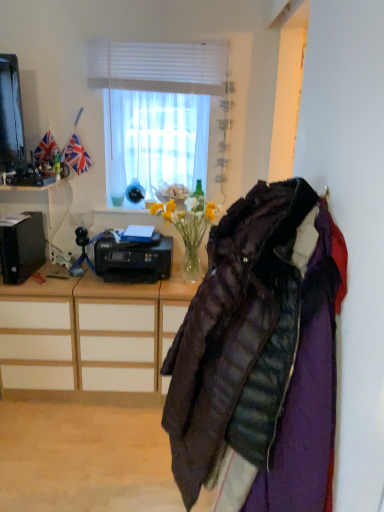
Question: From the image's perspective, is black plastic printer at left, the 2th desk ordered from the bottom, on white matte window at upper center?

Choices:
 (A) yes
 (B) no

Answer: (B)

Question: Is black plastic printer at left, the 2th desk ordered from the bottom, thinner than white matte window at upper center?

Choices:
 (A) yes
 (B) no

Answer: (B)

Question: Is black plastic printer at left, the 2th desk ordered from the bottom, smaller than white matte window at upper center?

Choices:
 (A) yes
 (B) no

Answer: (B)

Question: Does black plastic printer at left, the 2th desk ordered from the bottom, touch white matte window at upper center?

Choices:
 (A) no
 (B) yes

Answer: (A)

Question: Considering the relative positions of black plastic printer at left, the 2th desk ordered from the bottom, and white matte window at upper center in the image provided, is black plastic printer at left, the 2th desk ordered from the bottom, to the left of white matte window at upper center from the viewer's perspective?

Choices:
 (A) no
 (B) yes

Answer: (B)

Question: Is quilted dark brown jacket at right bigger or smaller than black plastic printer at center?

Choices:
 (A) big
 (B) small

Answer: (A)

Question: Considering the positions of quilted dark brown jacket at right and black plastic printer at center in the image, is quilted dark brown jacket at right wider or thinner than black plastic printer at center?

Choices:
 (A) wide
 (B) thin

Answer: (A)

Question: Is point (284, 287) positioned closer to the camera than point (147, 256)?

Choices:
 (A) farther
 (B) closer

Answer: (B)

Question: Is quilted dark brown jacket at right spatially inside black plastic printer at center, or outside of it?

Choices:
 (A) inside
 (B) outside

Answer: (B)

Question: In terms of size, does wooden desk at left, the first desk when ordered from bottom to top, appear bigger or smaller than black plastic printer at center?

Choices:
 (A) small
 (B) big

Answer: (B)

Question: Is wooden desk at left, the 2th desk viewed from the top, in front of or behind black plastic printer at center in the image?

Choices:
 (A) behind
 (B) front

Answer: (B)

Question: From their relative heights in the image, would you say wooden desk at left, the first desk when ordered from bottom to top, is taller or shorter than black plastic printer at center?

Choices:
 (A) tall
 (B) short

Answer: (A)

Question: Is point coord(1,373) closer or farther from the camera than point coord(168,245)?

Choices:
 (A) closer
 (B) farther

Answer: (B)

Question: From the image's perspective, is black plastic printer at left, which ranks as the first desk in top-to-bottom order, above or below quilted dark brown jacket at right?

Choices:
 (A) below
 (B) above

Answer: (B)

Question: Choose the correct answer: Is black plastic printer at left, which ranks as the first desk in top-to-bottom order, inside quilted dark brown jacket at right or outside it?

Choices:
 (A) outside
 (B) inside

Answer: (A)